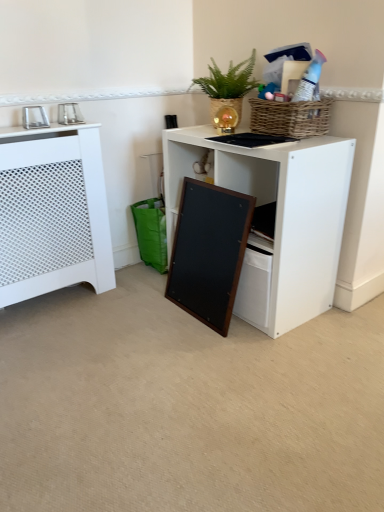
You are a GUI agent. You are given a task and a screenshot of the screen. Output one action in this format:
    pyautogui.click(x=<x>, y=<y>)
    Task: Click on the free location in front of white perforated radiator at left
    
    Given the screenshot: What is the action you would take?
    pyautogui.click(x=57, y=340)